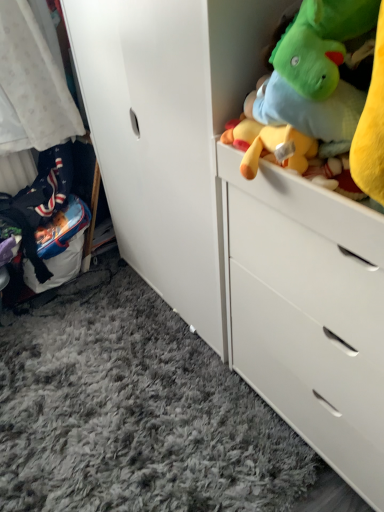
Based on the photo, what is the approximate height of soft plush toys at upper right?

The height of soft plush toys at upper right is 14.66 inches.

Locate an element on the screen. This screenshot has height=512, width=384. soft plush toys at upper right is located at coordinates (332, 88).

From a real-world perspective, is white matte chest of drawers at upper right located higher than soft plush toys at upper right?

Incorrect, from a real-world perspective, white matte chest of drawers at upper right is lower than soft plush toys at upper right.

Does point (246, 236) come farther from viewer compared to point (321, 124)?

Yes.

Who is bigger, white matte chest of drawers at upper right or soft plush toys at upper right?

With larger size is white matte chest of drawers at upper right.

Is white matte chest of drawers at upper right not within soft plush toys at upper right?

Yes, white matte chest of drawers at upper right is located beyond the bounds of soft plush toys at upper right.

From a real-world perspective, which object rests below the other?

From a 3D spatial view, white matte chest of drawers at upper right is below.

Which object is thinner, white matte chest of drawers at upper right or white soft fabric at left?

Thinner between the two is white soft fabric at left.

Is white matte chest of drawers at upper right taller or shorter than white soft fabric at left?

Considering their sizes, white matte chest of drawers at upper right has more height than white soft fabric at left.

Is white matte chest of drawers at upper right placed right next to white soft fabric at left?

No, white matte chest of drawers at upper right is not touching white soft fabric at left.

Can you confirm if white soft fabric at left is shorter than soft plush toys at upper right?

No.

Is soft plush toys at upper right at the back of white soft fabric at left?

No, white soft fabric at left is not facing away from soft plush toys at upper right.

From the picture: Is white soft fabric at left wider than soft plush toys at upper right?

No.

From a real-world perspective, which object stands above the other?

From a 3D spatial view, soft plush toys at upper right is above.

Considering the relative sizes of white soft fabric at left and white matte chest of drawers at upper right in the image provided, is white soft fabric at left wider than white matte chest of drawers at upper right?

In fact, white soft fabric at left might be narrower than white matte chest of drawers at upper right.

This screenshot has width=384, height=512. What are the coordinates of `the chest of drawers lying below the white soft fabric at left (from the image's perspective)` in the screenshot? It's located at (308, 312).

Consider the image. From a real-world perspective, which is physically above, white soft fabric at left or white matte chest of drawers at upper right?

From a 3D spatial view, white soft fabric at left is above.

From the image's perspective, is soft plush toys at upper right over white soft fabric at left?

Incorrect, from the image's perspective, soft plush toys at upper right is lower than white soft fabric at left.

Considering the positions of objects soft plush toys at upper right and white soft fabric at left in the image provided, who is behind, soft plush toys at upper right or white soft fabric at left?

white soft fabric at left is behind.

Consider the image. Can you confirm if soft plush toys at upper right is bigger than white soft fabric at left?

Indeed, soft plush toys at upper right has a larger size compared to white soft fabric at left.

At what (x,y) coordinates should I click in order to perform the action: click on baby clothe above the soft plush toys at upper right (from the image's perspective). Please return your answer as a coordinate pair (x, y). Image resolution: width=384 pixels, height=512 pixels. Looking at the image, I should click on (31, 86).

Would you say soft plush toys at upper right contains white matte chest of drawers at upper right?

Definitely not — white matte chest of drawers at upper right is not inside soft plush toys at upper right.

Considering the relative sizes of soft plush toys at upper right and white matte chest of drawers at upper right in the image provided, is soft plush toys at upper right thinner than white matte chest of drawers at upper right?

Indeed, soft plush toys at upper right has a lesser width compared to white matte chest of drawers at upper right.

Which is more to the right, soft plush toys at upper right or white matte chest of drawers at upper right?

white matte chest of drawers at upper right is more to the right.

Does soft plush toys at upper right turn towards white matte chest of drawers at upper right?

No, soft plush toys at upper right is not oriented towards white matte chest of drawers at upper right.

Find the location of a particular element. This screenshot has width=384, height=512. the chest of drawers that appears behind the soft plush toys at upper right is located at coordinates (308, 312).

This screenshot has width=384, height=512. I want to click on the chest of drawers that appears below the white soft fabric at left (from the image's perspective), so click(x=308, y=312).

Which object lies nearer to the anchor point white soft fabric at left, white matte chest of drawers at upper right or soft plush toys at upper right?

Among the two, white matte chest of drawers at upper right is located nearer to white soft fabric at left.

When comparing their distances from white soft fabric at left, does soft plush toys at upper right or white matte chest of drawers at upper right seem closer?

white matte chest of drawers at upper right.

Estimate the real-world distances between objects in this image. Which object is further from white matte chest of drawers at upper right, soft plush toys at upper right or white soft fabric at left?

white soft fabric at left is further to white matte chest of drawers at upper right.

Which object lies nearer to the anchor point white matte chest of drawers at upper right, white soft fabric at left or soft plush toys at upper right?

soft plush toys at upper right.

From the image, which object appears to be farther from soft plush toys at upper right, white matte chest of drawers at upper right or white soft fabric at left?

white soft fabric at left lies further to soft plush toys at upper right than the other object.

Which object lies further to the anchor point soft plush toys at upper right, white soft fabric at left or white matte chest of drawers at upper right?

white soft fabric at left.

This screenshot has height=512, width=384. Find the location of `stuff situated between white soft fabric at left and white matte chest of drawers at upper right from left to right`. stuff situated between white soft fabric at left and white matte chest of drawers at upper right from left to right is located at coordinates (332, 88).